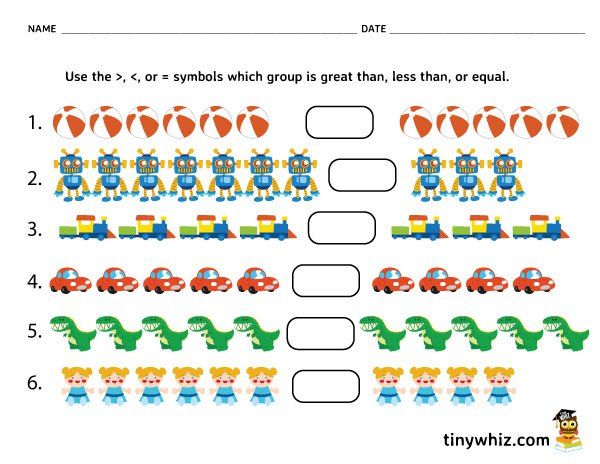
At what (x,y) coordinates should I click in order to perform the action: click on dolls. Please return your answer as a coordinate pair (x, y). The height and width of the screenshot is (464, 600). Looking at the image, I should click on (82, 375), (114, 384), (152, 380), (184, 375), (225, 378), (265, 380), (386, 386), (423, 383), (458, 387), (505, 383).